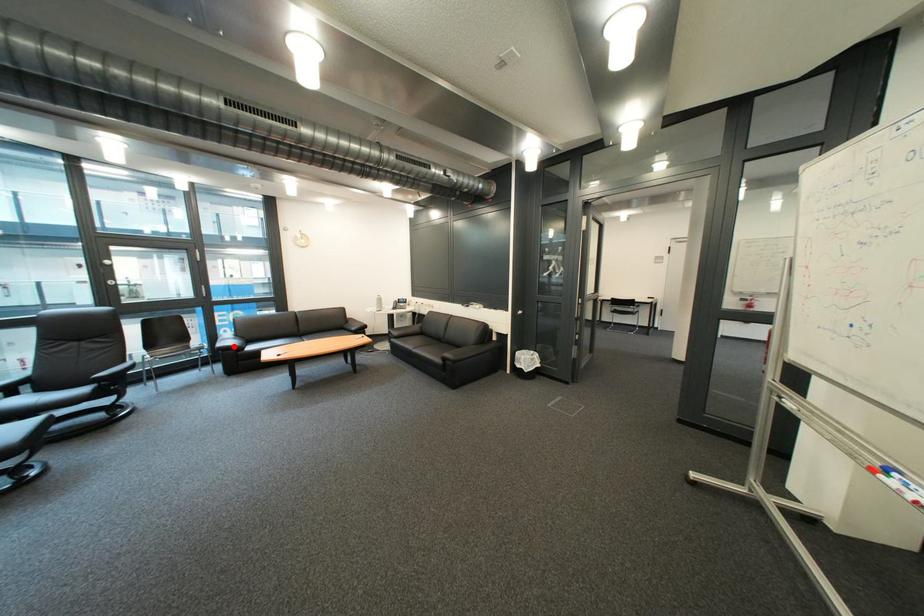
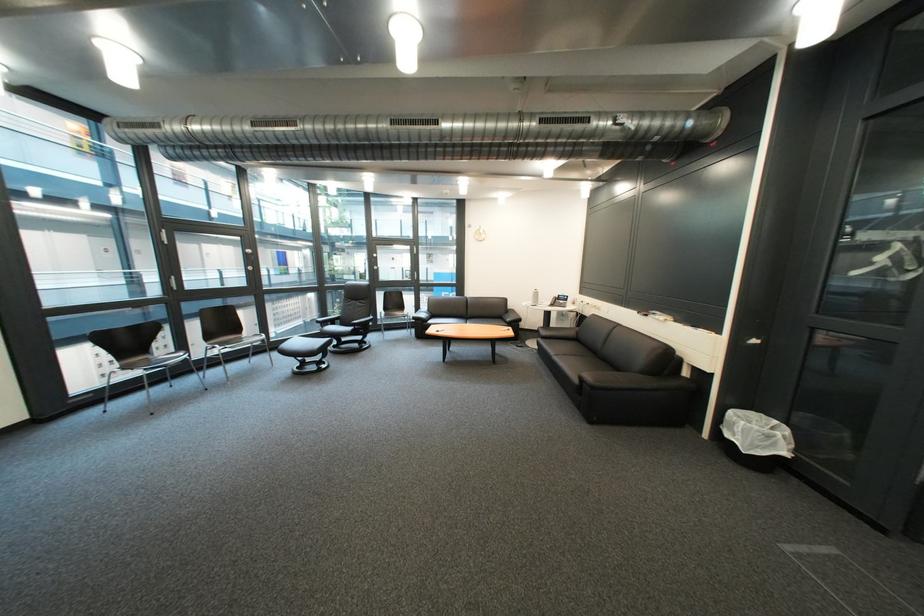
Question: I am providing you with two images of the same scene from different viewpoints. A red point is shown in image1. For the corresponding object point in image2, is it positioned nearer or farther from the camera?

Choices:
 (A) Nearer
 (B) Farther

Answer: (B)